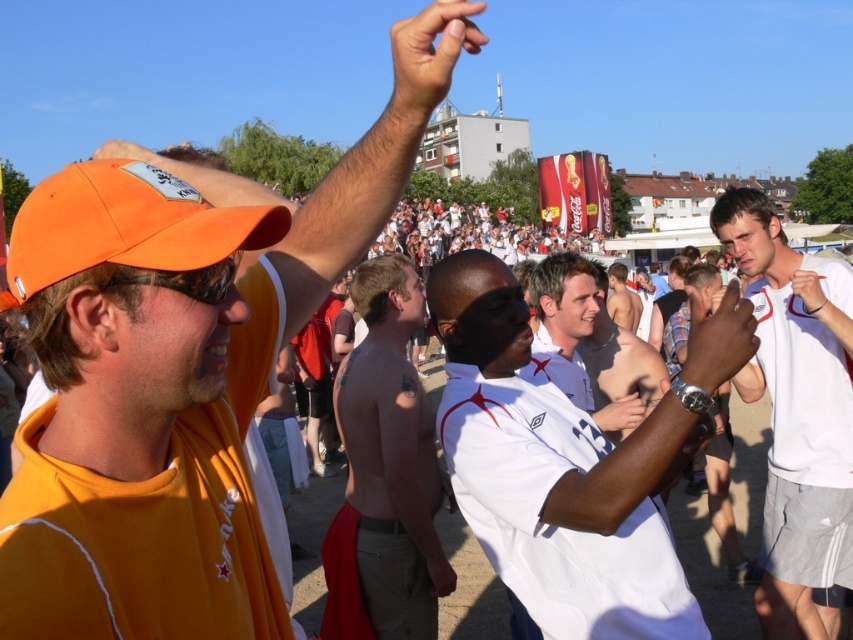
You are at a social event and see the white matte shirt at center and the matte black hand at center. Which object is positioned lower in the image?

The white matte shirt at center is located below the matte black hand at center, so the white matte shirt at center is positioned lower.

You are at an event and need to decide which item is wider. You see the orange matte cap at upper left and the shiny metallic belt at center. Which one is wider?

The orange matte cap at upper left is wider than the shiny metallic belt at center.